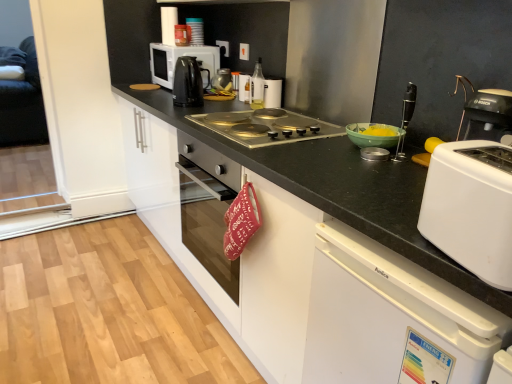
Question: Considering the relative positions of black glossy electric kettle at upper center, the fourth kitchen appliance when ordered from left to right, and metallic silver gas stove at center in the image provided, is black glossy electric kettle at upper center, the fourth kitchen appliance when ordered from left to right, to the left or to the right of metallic silver gas stove at center?

Choices:
 (A) right
 (B) left

Answer: (B)

Question: From a real-world perspective, is black glossy electric kettle at upper center, the fifth kitchen appliance viewed from the right, physically located above or below metallic silver gas stove at center?

Choices:
 (A) below
 (B) above

Answer: (B)

Question: Which object is positioned farthest from the metallic silver canister at upper center, which is counted as the 3th kitchen appliance, starting from the left?

Choices:
 (A) white matte cabinet at center, marked as the first cabinetry in a back-to-front arrangement
 (B) clear glass bottle at center, the second kitchen appliance in the right-to-left sequence
 (C) white glossy microwave at upper left, which appears as the 1th kitchen appliance when viewed from the left
 (D) translucent glass bottle at center, the sixth kitchen appliance viewed from the left
 (E) white glossy canister at upper center, which is the first kitchen appliance in right-to-left order

Answer: (A)

Question: Estimate the real-world distances between objects in this image. Which object is farther from the white matte cabinet at center, marked as the first cabinetry in a back-to-front arrangement?

Choices:
 (A) white plastic dishwasher at lower right, the first cabinetry positioned from the front
 (B) white glossy microwave at upper left, the 8th kitchen appliance from the right
 (C) white glossy canister at upper center, positioned as the 8th kitchen appliance in left-to-right order
 (D) clear glass bottle at center, the seventh kitchen appliance from the left
 (E) metallic silver canister at upper center, which is counted as the 3th kitchen appliance, starting from the left

Answer: (E)